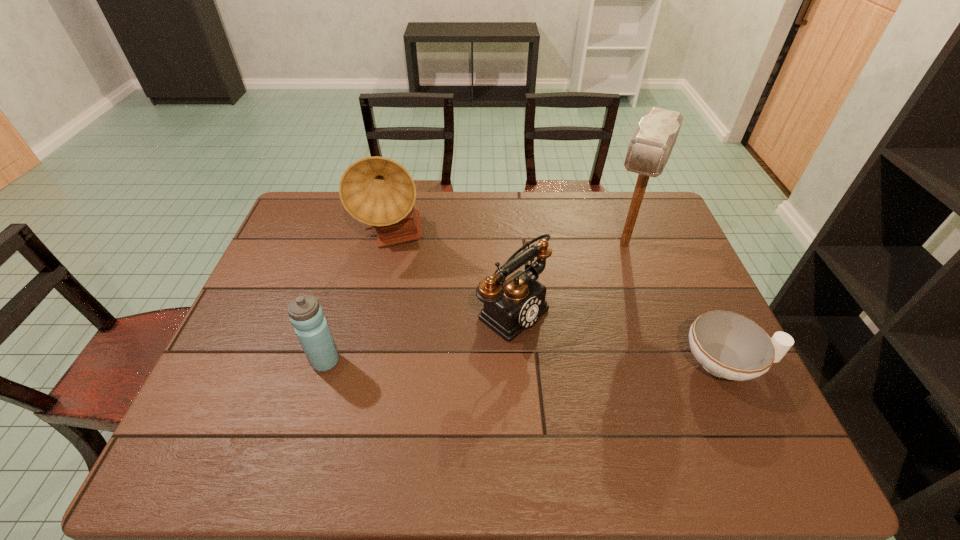
Locate an element on the screen. vacant area that satisfies the following two spatial constraints: 1. on the front side of the water bottle; 2. on the side with the handle of the chinaware is located at coordinates (324, 363).

The width and height of the screenshot is (960, 540). In order to click on free location that satisfies the following two spatial constraints: 1. on the front side of the water bottle; 2. on the side with the handle of the chinaware in this screenshot , I will do `click(324, 363)`.